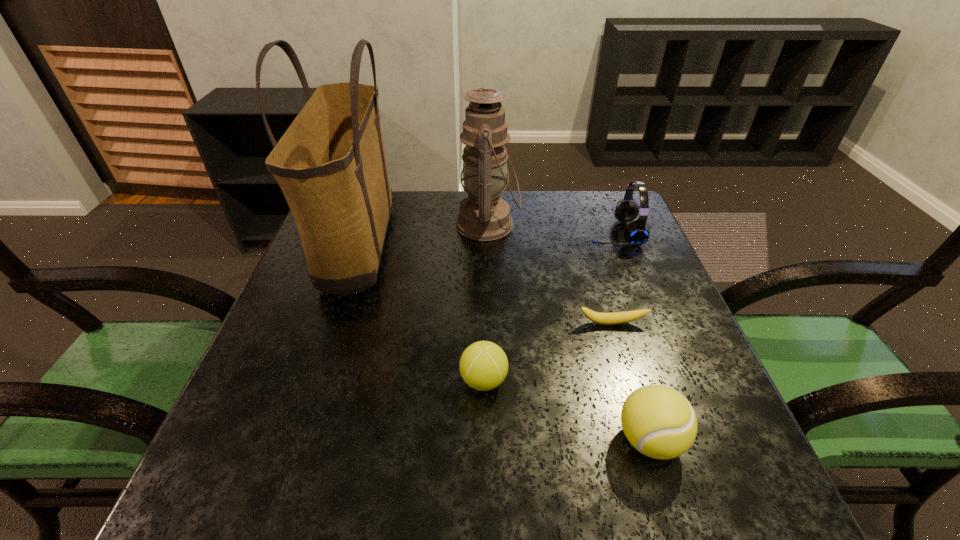
At what (x,y) coordinates should I click in order to perform the action: click on headset that is at the far edge. Please return your answer as a coordinate pair (x, y). Image resolution: width=960 pixels, height=540 pixels. Looking at the image, I should click on (636, 233).

This screenshot has height=540, width=960. I want to click on object that is at the near edge, so click(x=658, y=421).

Locate an element on the screen. The width and height of the screenshot is (960, 540). object positioned at the left edge is located at coordinates (330, 164).

Where is `headset that is at the right edge`? headset that is at the right edge is located at coordinates (636, 233).

Identify the location of tennis ball that is at the right edge. (658, 421).

I want to click on banana that is at the right edge, so click(x=615, y=318).

Where is `object that is at the far left corner`? object that is at the far left corner is located at coordinates (330, 164).

Identify the location of object that is at the far right corner. The image size is (960, 540). (636, 233).

You are a GUI agent. You are given a task and a screenshot of the screen. Output one action in this format:
    pyautogui.click(x=<x>, y=<y>)
    Task: Click on the object that is at the near right corner
    This screenshot has width=960, height=540.
    Given the screenshot: What is the action you would take?
    pyautogui.click(x=658, y=421)

At what (x,y) coordinates should I click in order to perform the action: click on vacant position at the far edge of the desktop. Please return your answer as a coordinate pair (x, y). The image size is (960, 540). Looking at the image, I should click on (398, 232).